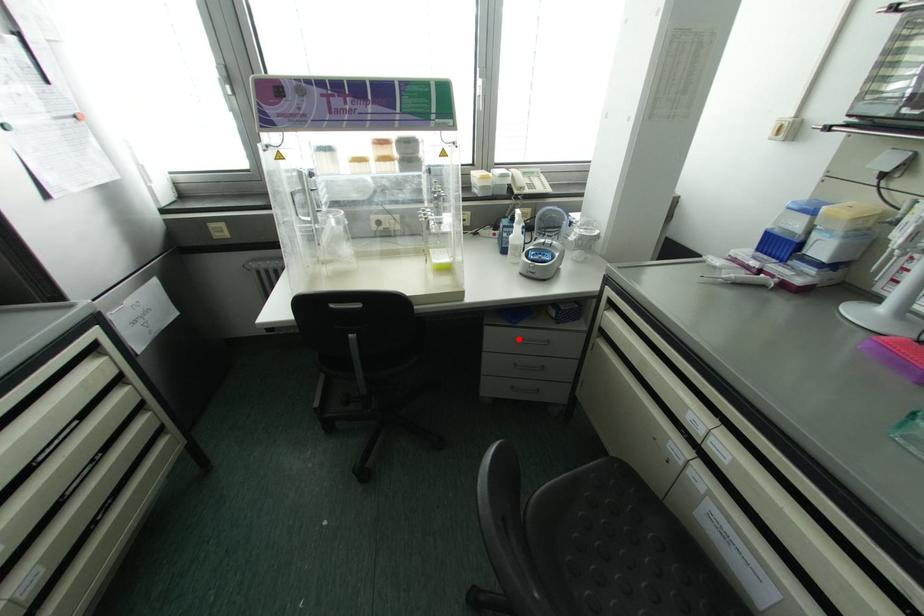
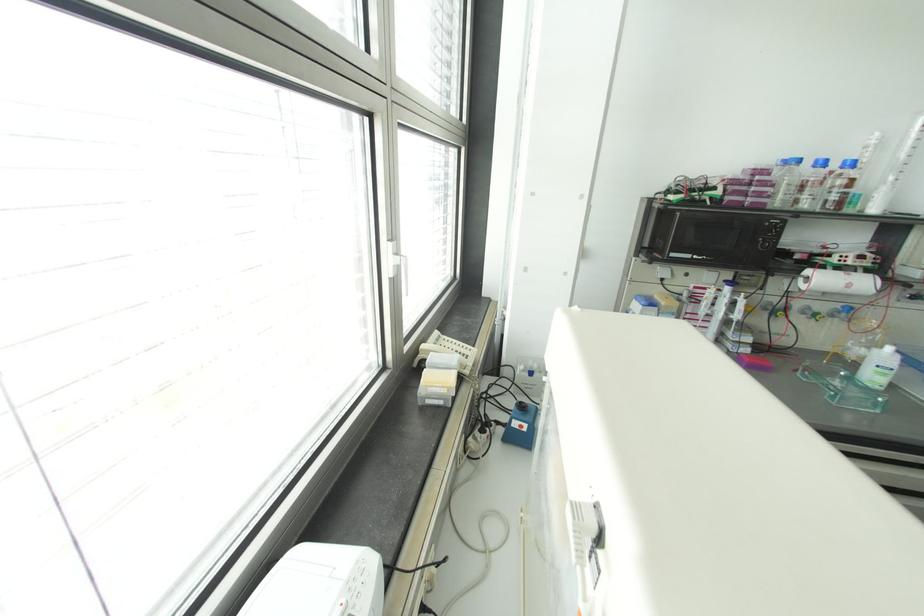
Question: I am providing you with two images of the same scene from different viewpoints. A red point is marked on the first image. Is the red point's position out of view in image 2?

Choices:
 (A) Yes
 (B) No

Answer: (A)